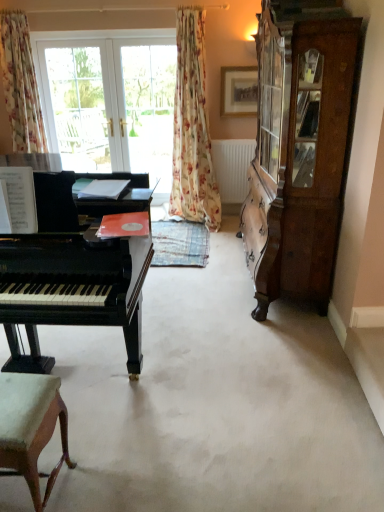
I want to click on empty space that is ontop of white matte radiator at center (from a real-world perspective), so click(230, 137).